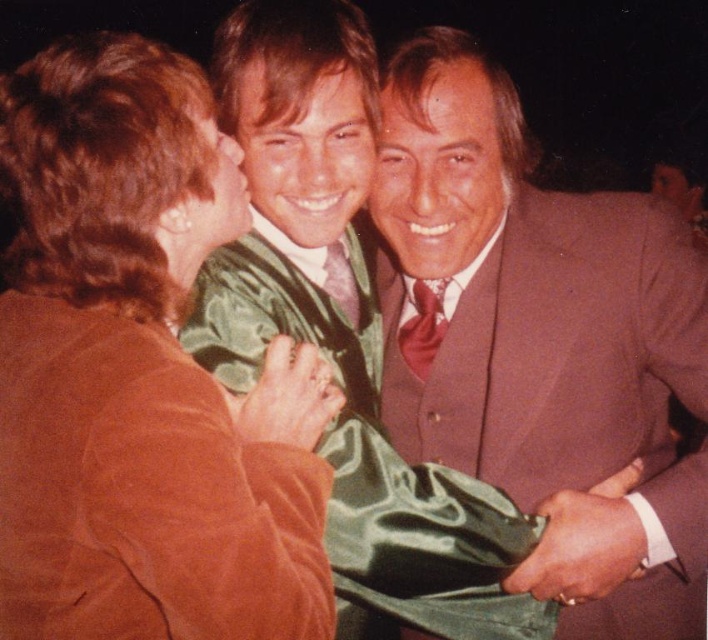
You are at a graduation ceremony and need to hand out a diploma to the graduate wearing the satin green dress at center. To reach them, you must walk past the person in the brown suede jacket at upper left. Is there enough space between the two to walk through comfortably?

The brown suede jacket at upper left is positioned on the left side of the satin green dress at center, so there is space between them to walk through comfortably.

You are a photographer at a graduation ceremony. You need to capture a photo where both the brown suede jacket at upper left and the matte brown suit at center are visible. Which object should be placed closer to the camera to ensure both are in frame?

The brown suede jacket at upper left is shorter than the matte brown suit at center. To ensure both are in frame, place the brown suede jacket at upper left closer to the camera so its height matches the matte brown suit at center.

You are organizing a photo album and want to place the brown suede jacket at upper left and the satin green dress at center side by side. Which object should you allocate more space for in the album?

The satin green dress at center requires more space because it occupies more space than the brown suede jacket at upper left according to the description.